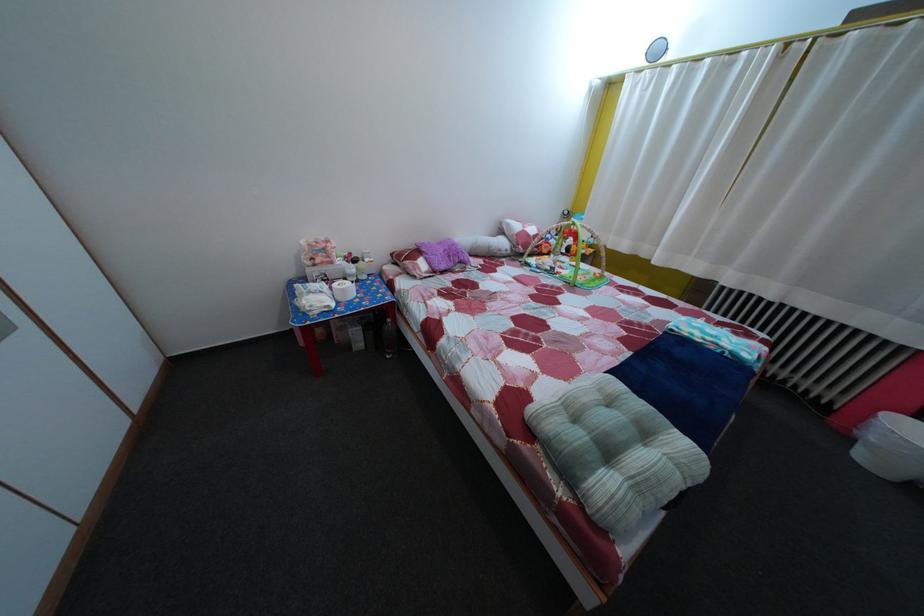
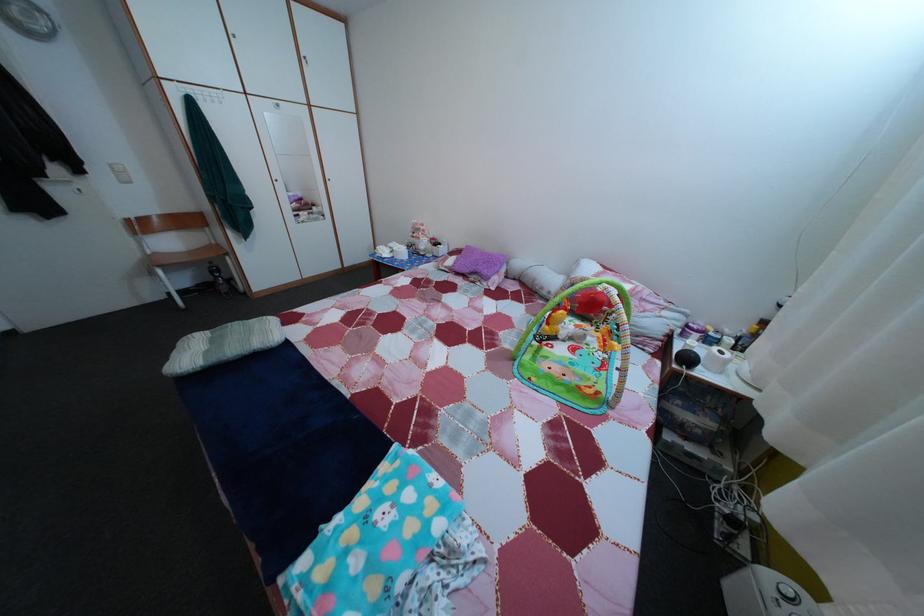
Find the pixel in the second image that matches (450,252) in the first image.

(492, 261)